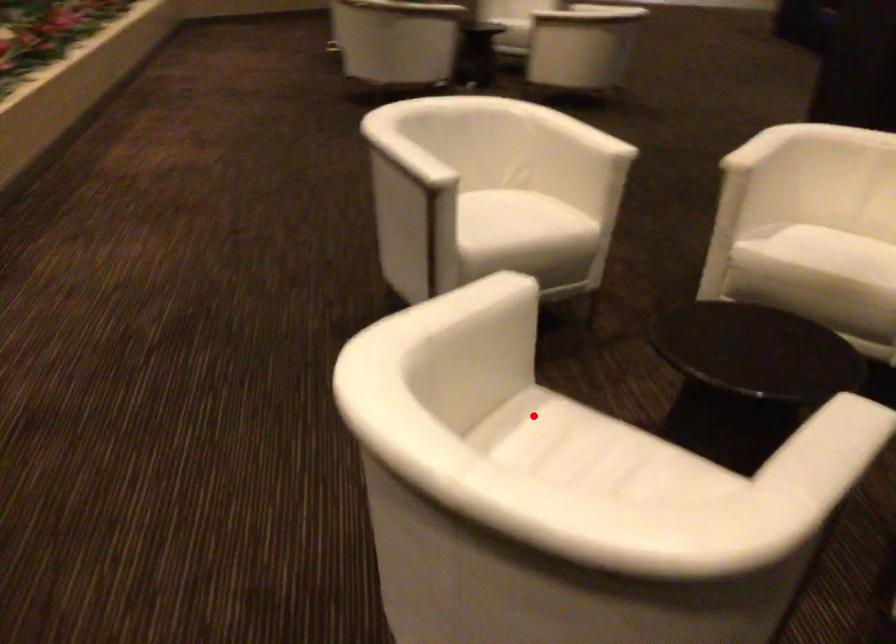
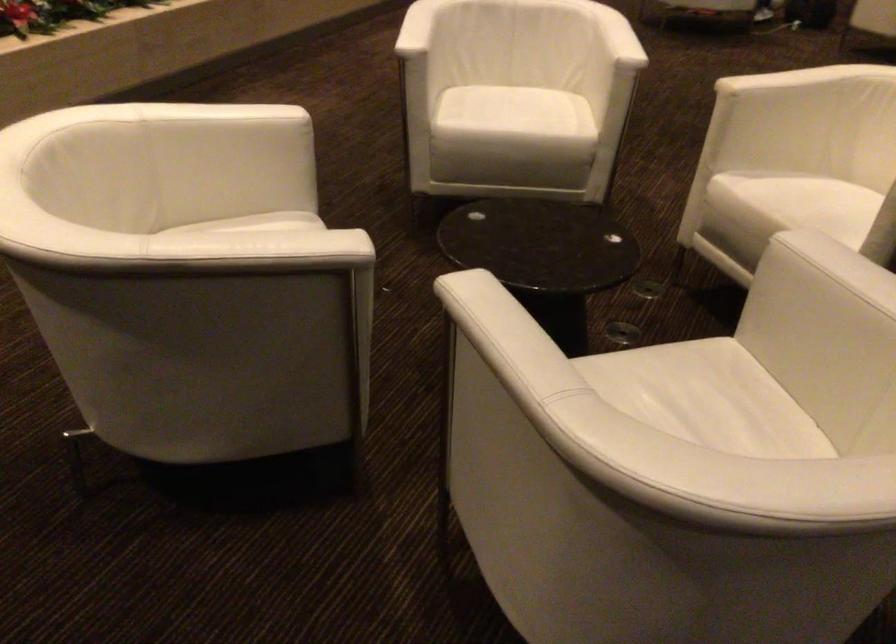
Question: I am providing you with two images of the same scene from different viewpoints. A red point is shown in image1. For the corresponding object point in image2, is it positioned nearer or farther from the camera?

Choices:
 (A) Nearer
 (B) Farther

Answer: (B)